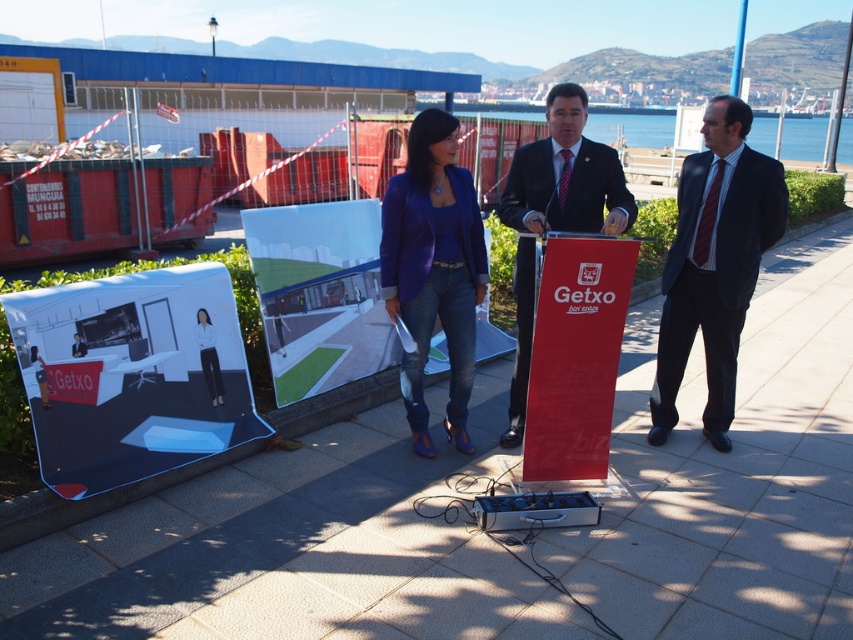
Question: Which point appears farthest from the camera in this image?

Choices:
 (A) (554, 90)
 (B) (743, 42)
 (C) (669, 568)
 (D) (422, 237)

Answer: (B)

Question: Which is farther from the matte concrete pavement at center?

Choices:
 (A) matte black suit at center
 (B) dark blue suit at center

Answer: (A)

Question: Is matte black suit at center behind blue plastic pole at upper center?

Choices:
 (A) no
 (B) yes

Answer: (A)

Question: Does dark blue suit at center appear under matte purple blazer at center?

Choices:
 (A) no
 (B) yes

Answer: (A)

Question: Which of the following is the closest to the observer?

Choices:
 (A) matte black suit at center
 (B) dark blue suit at center

Answer: (A)

Question: Is matte concrete pavement at center to the right of matte purple blazer at center from the viewer's perspective?

Choices:
 (A) yes
 (B) no

Answer: (A)